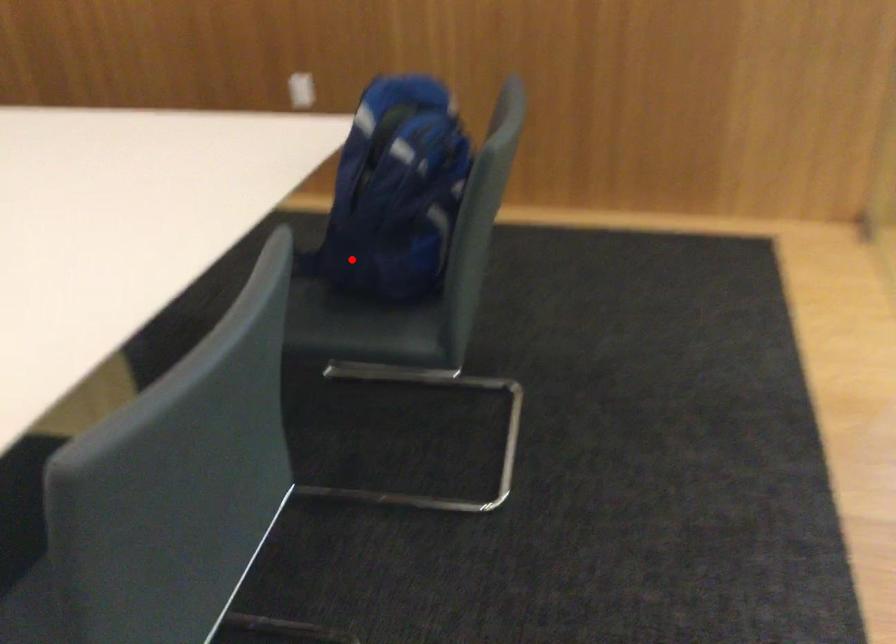
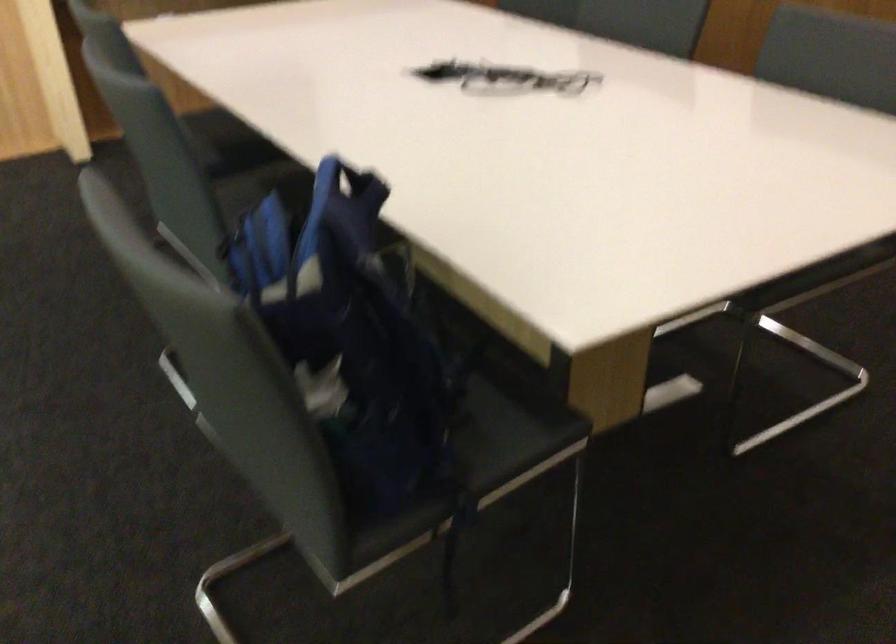
In the second image, find the point that corresponds to the highlighted location in the first image.

(484, 451)